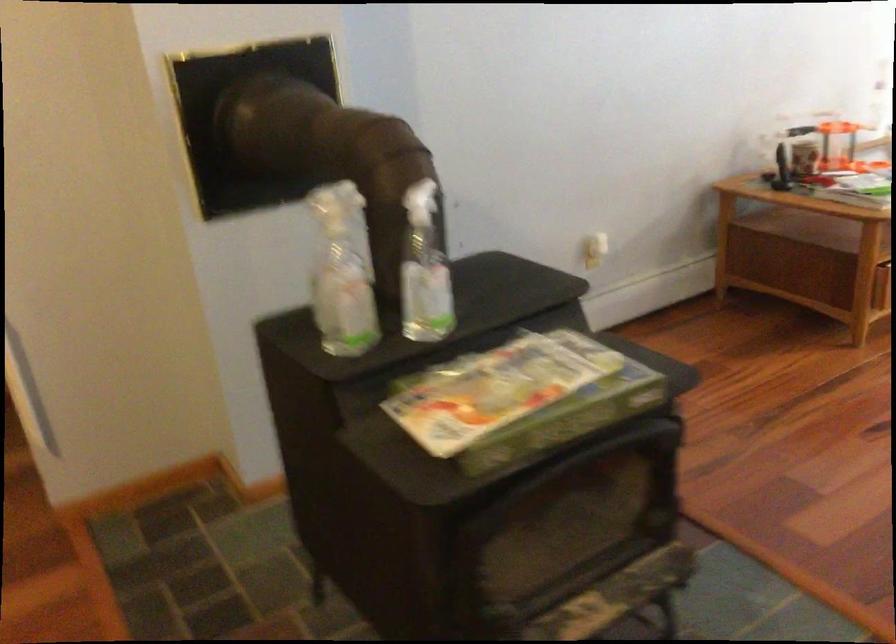
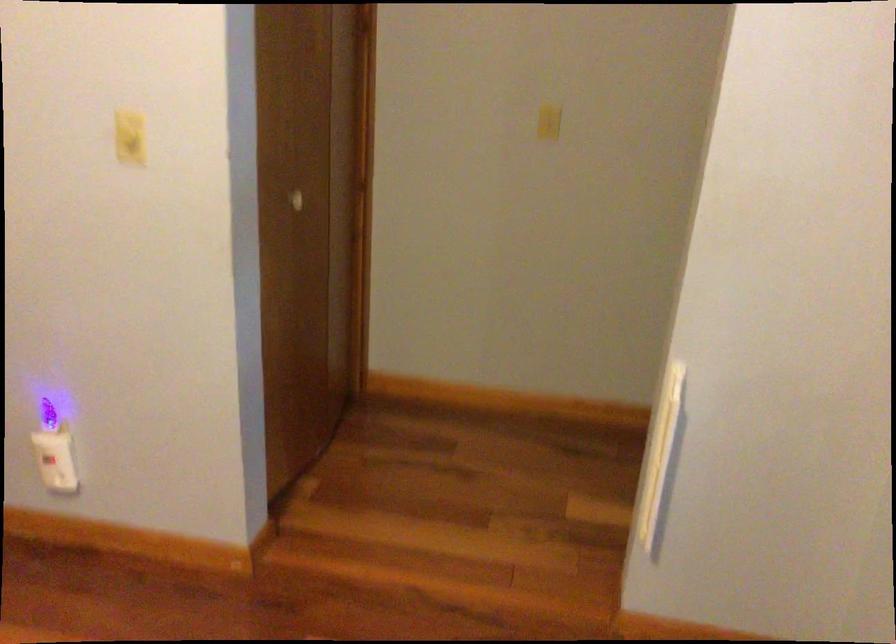
Question: The camera is either moving clockwise (left) or counter-clockwise (right) around the object. The first image is from the beginning of the video and the second image is from the end. Is the camera moving left or right when shooting the video?

Choices:
 (A) Left
 (B) Right

Answer: (B)